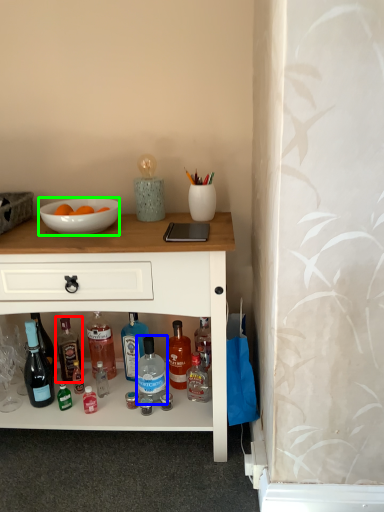
Question: Considering the real-world distances, which object is closest to bottle (highlighted by a red box)? bottle (highlighted by a blue box) or bowl (highlighted by a green box).

Choices:
 (A) bottle
 (B) bowl

Answer: (A)